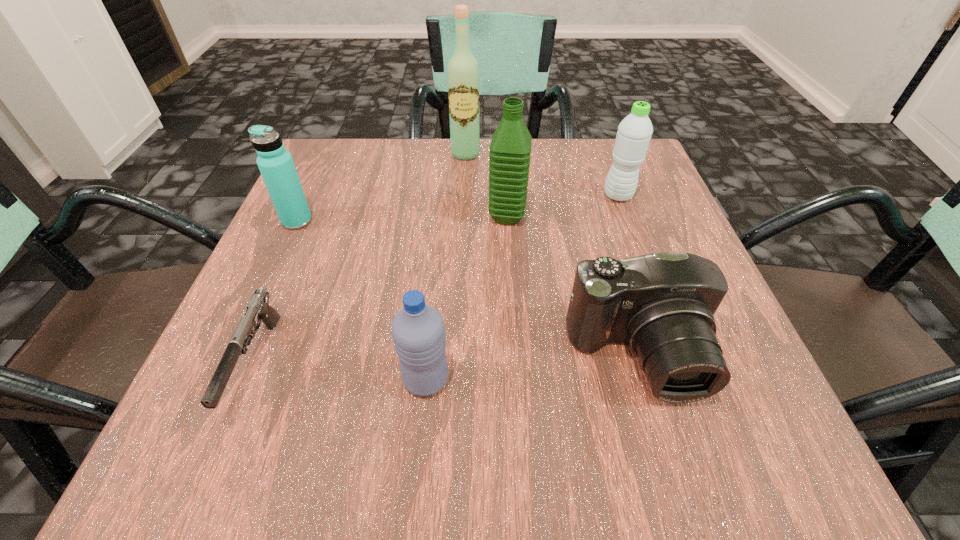
Where is `empty location between the shortest object and the third object from right to left`? The width and height of the screenshot is (960, 540). empty location between the shortest object and the third object from right to left is located at coordinates (382, 290).

In order to click on free space between the third water bottle from right to left and the camera in this screenshot , I will do `click(532, 368)`.

The height and width of the screenshot is (540, 960). I want to click on empty space that is in between the tallest object and the leftmost water bottle, so click(x=381, y=187).

The width and height of the screenshot is (960, 540). Find the location of `free space between the leftmost water bottle and the shortest object`. free space between the leftmost water bottle and the shortest object is located at coordinates (276, 293).

Where is `vacant area between the leftmost water bottle and the sixth shortest object`? The height and width of the screenshot is (540, 960). vacant area between the leftmost water bottle and the sixth shortest object is located at coordinates (402, 219).

Identify the location of unoccupied area between the shortest object and the camera. (447, 361).

Locate an element on the screen. The width and height of the screenshot is (960, 540). free space that is in between the gun and the farthest water bottle is located at coordinates (437, 280).

Locate an element on the screen. unoccupied area between the sixth nearest object and the leftmost water bottle is located at coordinates (458, 208).

Where is `object that stands as the fifth closest to the farthest water bottle`? The width and height of the screenshot is (960, 540). object that stands as the fifth closest to the farthest water bottle is located at coordinates (276, 165).

Select which object appears as the fifth closest to the third water bottle from right to left. Please provide its 2D coordinates. Your answer should be formatted as a tuple, i.e. [(x, y)], where the tuple contains the x and y coordinates of a point satisfying the conditions above.

[(634, 132)]